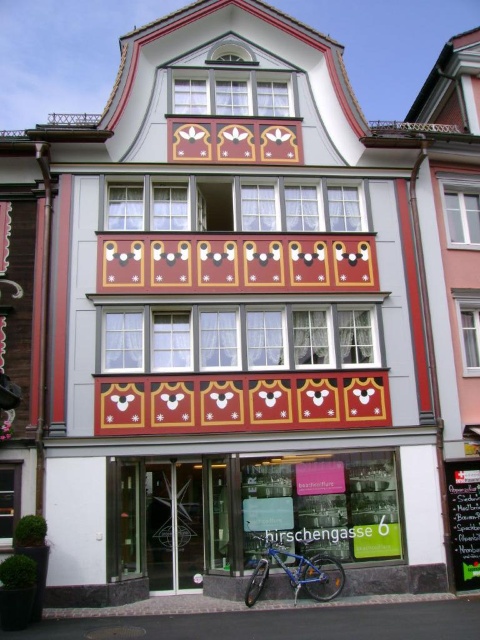
Is point (268, 465) more distant than point (309, 573)?

Yes, it is behind point (309, 573).

Which is more to the right, metallic bicycle at lower center or blue metallic bicycle at lower center?

blue metallic bicycle at lower center

Find the location of a particular element. metallic bicycle at lower center is located at coordinates (248, 513).

Locate an element on the screen. Image resolution: width=480 pixels, height=640 pixels. metallic bicycle at lower center is located at coordinates (248, 513).